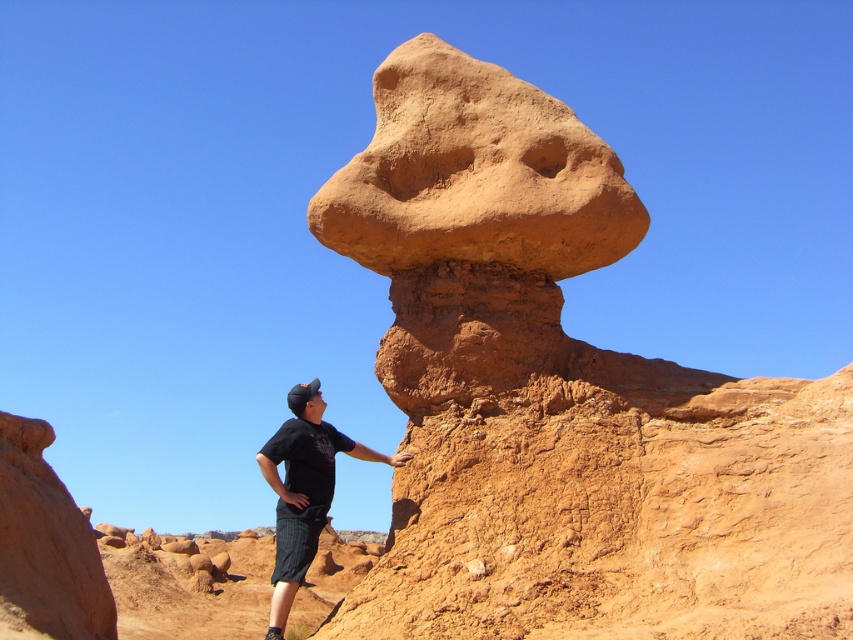
Does rustic sandstone mushroom at center appear on the right side of black cotton shirt at center?

Indeed, rustic sandstone mushroom at center is positioned on the right side of black cotton shirt at center.

Does rustic sandstone mushroom at center appear over black cotton shirt at center?

Yes, rustic sandstone mushroom at center is above black cotton shirt at center.

Between point (413, 365) and point (291, 484), which one is positioned in front?

Point (291, 484)

At what (x,y) coordinates should I click in order to perform the action: click on rustic sandstone mushroom at center. Please return your answer as a coordinate pair (x, y). This screenshot has height=640, width=853. Looking at the image, I should click on (563, 397).